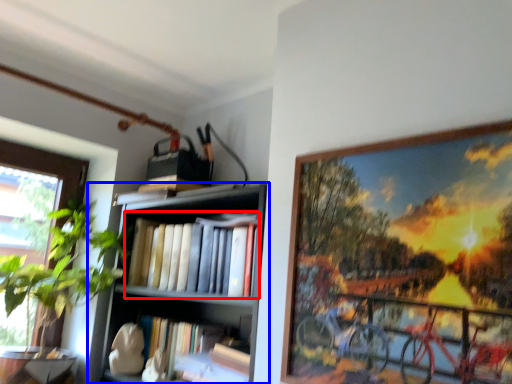
Question: Among these objects, which one is nearest to the camera, book (highlighted by a red box) or shelf (highlighted by a blue box)?

Choices:
 (A) book
 (B) shelf

Answer: (B)